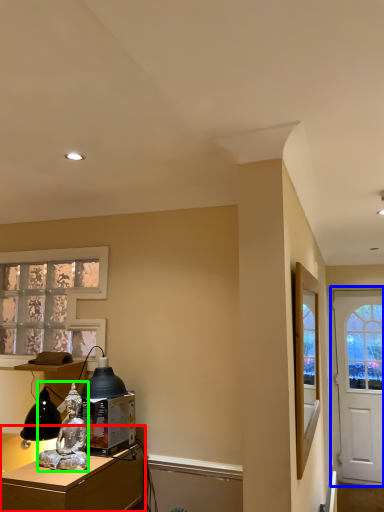
Question: Based on their relative distances, which object is nearer to desk (highlighted by a red box)? Choose from door (highlighted by a blue box) and person (highlighted by a green box).

Choices:
 (A) door
 (B) person

Answer: (B)